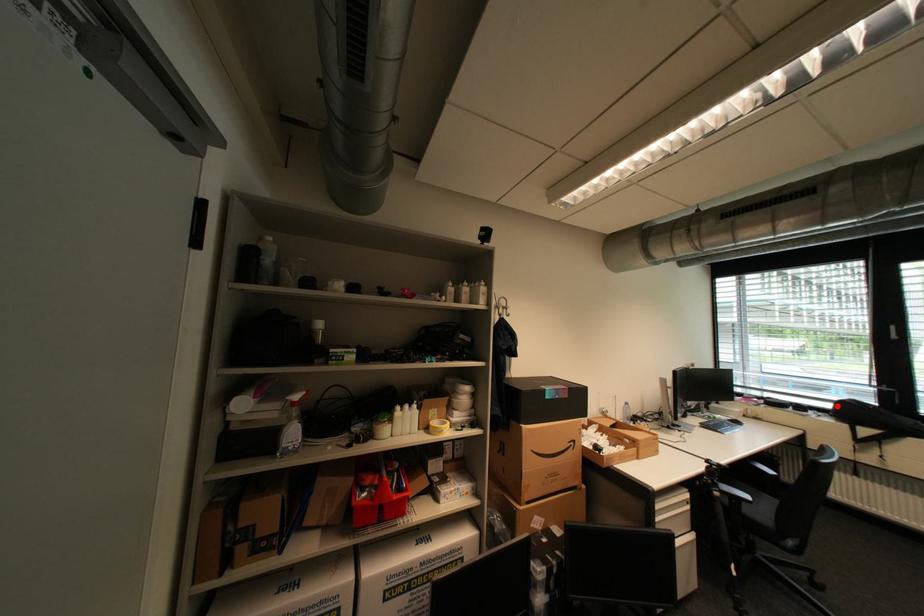
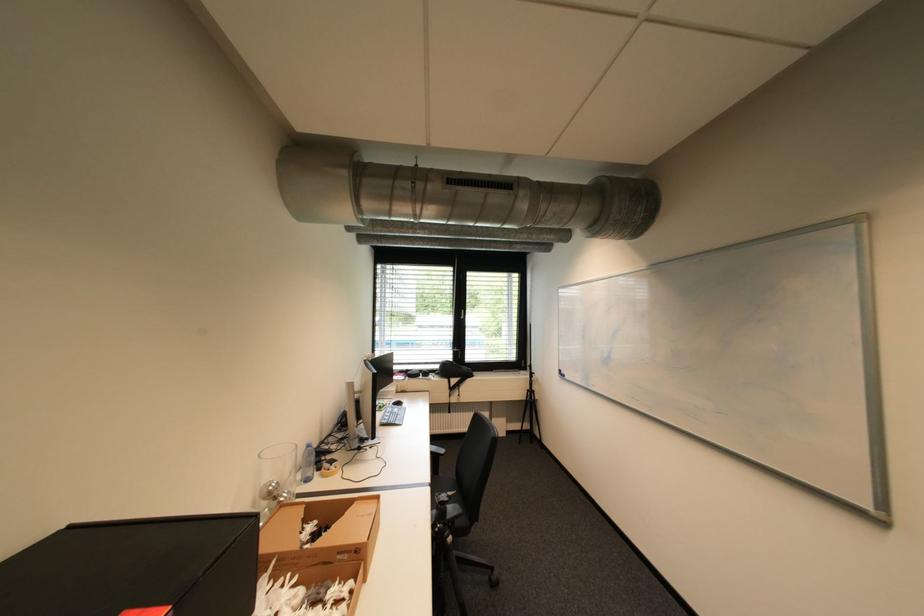
Find the pixel in the second image that matches the highlighted location in the first image.

(445, 368)